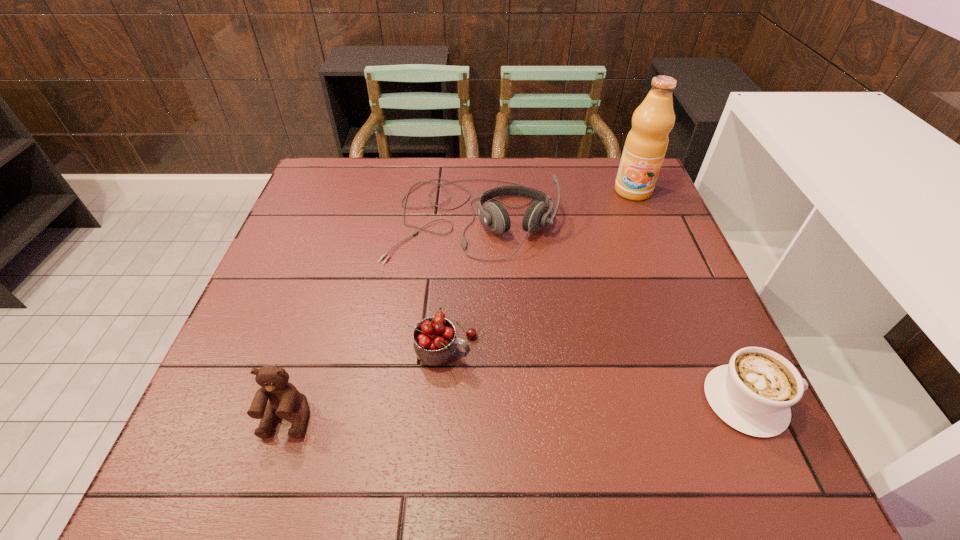
The image size is (960, 540). I want to click on vacant space on the desktop that is between the teddy bear and the cappuccino and is positioned on the outer surface of the headset, so click(x=463, y=411).

Locate an element on the screen. free space on the desktop that is between the teddy bear and the cappuccino and is positioned on the front label of the fruit juice is located at coordinates tap(578, 407).

This screenshot has height=540, width=960. What are the coordinates of `free spot on the desktop that is between the teddy bear and the shortest object and is positioned on the handle side of the pot filled with cherries` in the screenshot? It's located at (576, 407).